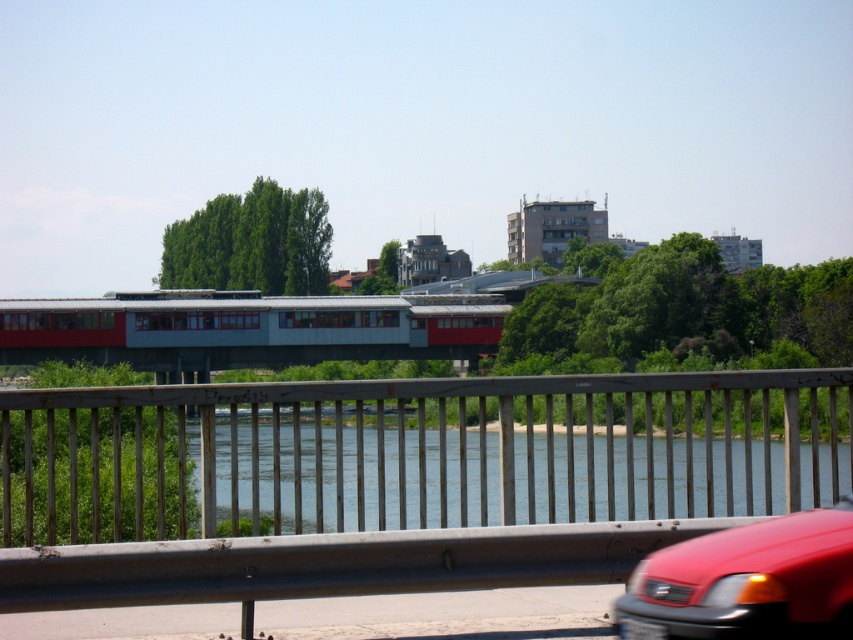
Is point (77, 596) positioned in front of point (430, 465)?

Yes, point (77, 596) is closer to viewer.

Is metallic gray railing at center to the right of blue water at center from the viewer's perspective?

In fact, metallic gray railing at center is to the left of blue water at center.

Describe the element at coordinates (396, 477) in the screenshot. I see `metallic gray railing at center` at that location.

Where is `metallic gray railing at center`? The height and width of the screenshot is (640, 853). metallic gray railing at center is located at coordinates (396, 477).

Is metallic gray railing at center taller than glossy red car at lower right?

Correct, metallic gray railing at center is much taller as glossy red car at lower right.

Does point (202, 385) lie in front of point (666, 616)?

No, (202, 385) is further to viewer.

Locate an element on the screen. metallic gray railing at center is located at coordinates pos(396,477).

Between point (328, 486) and point (648, 634), which one is positioned in front?

Positioned in front is point (648, 634).

Locate an element on the screen. blue water at center is located at coordinates (482, 476).